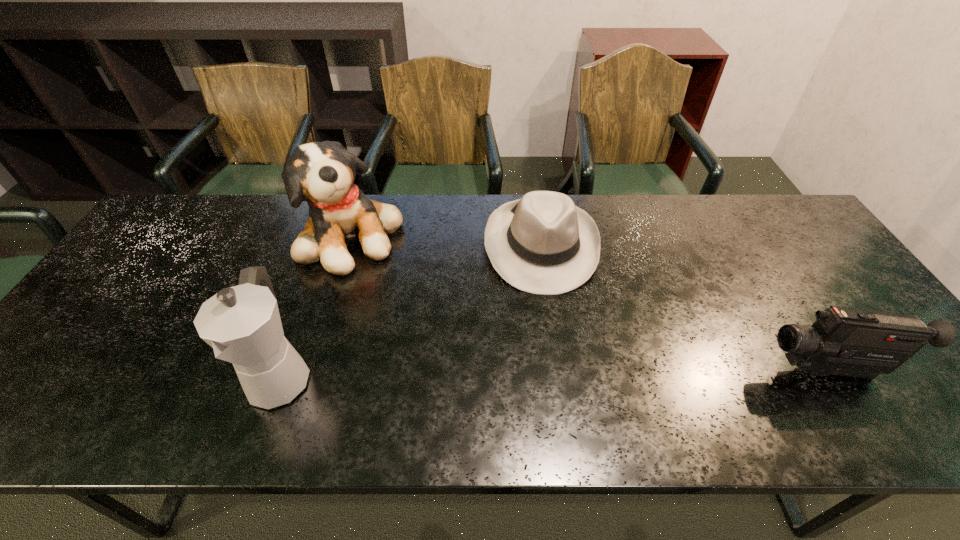
What are the coordinates of `vacant area in the image that satisfies the following two spatial constraints: 1. on the back side of the coffeepot; 2. on the left side of the puppy` in the screenshot? It's located at (330, 238).

Find the location of `vacant region that satisfies the following two spatial constraints: 1. on the back side of the rightmost object; 2. on the front-facing side of the coffeepot`. vacant region that satisfies the following two spatial constraints: 1. on the back side of the rightmost object; 2. on the front-facing side of the coffeepot is located at coordinates (282, 370).

Locate an element on the screen. The image size is (960, 540). free space that satisfies the following two spatial constraints: 1. on the front side of the puppy; 2. on the front-facing side of the third tallest object is located at coordinates (312, 370).

Identify the location of vacant space that satisfies the following two spatial constraints: 1. on the front side of the third tallest object; 2. on the front-facing side of the second object from right to left. (559, 370).

This screenshot has width=960, height=540. What are the coordinates of `vacant space that satisfies the following two spatial constraints: 1. on the back side of the rightmost object; 2. on the front-facing side of the coffeepot` in the screenshot? It's located at (282, 370).

The height and width of the screenshot is (540, 960). I want to click on free location that satisfies the following two spatial constraints: 1. on the back side of the rightmost object; 2. on the front-facing side of the coffeepot, so click(x=282, y=370).